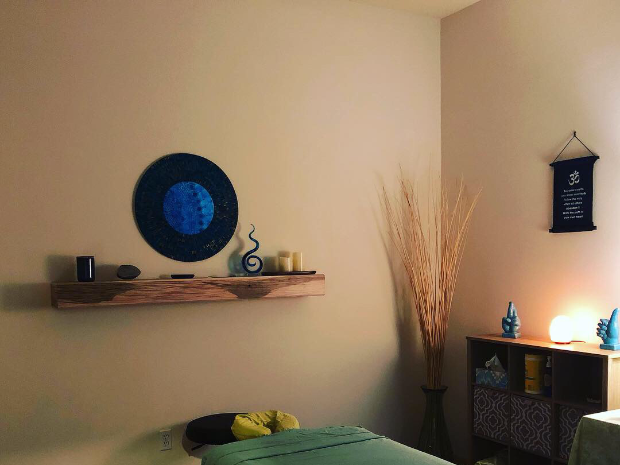
Find the location of a particular element. This screenshot has height=465, width=620. light blue circle on wall is located at coordinates (193, 202).